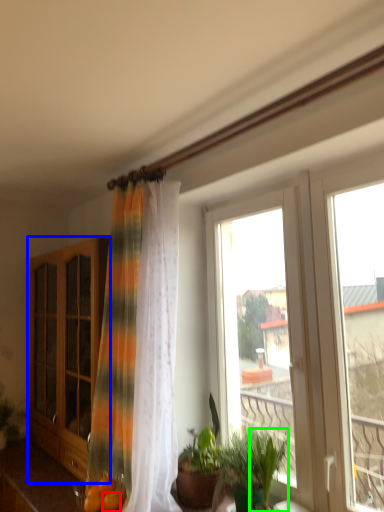
Question: Which is farther away from citrus fruit (highlighted by a red box)? cabinetry (highlighted by a blue box) or plant (highlighted by a green box)?

Choices:
 (A) cabinetry
 (B) plant

Answer: (A)